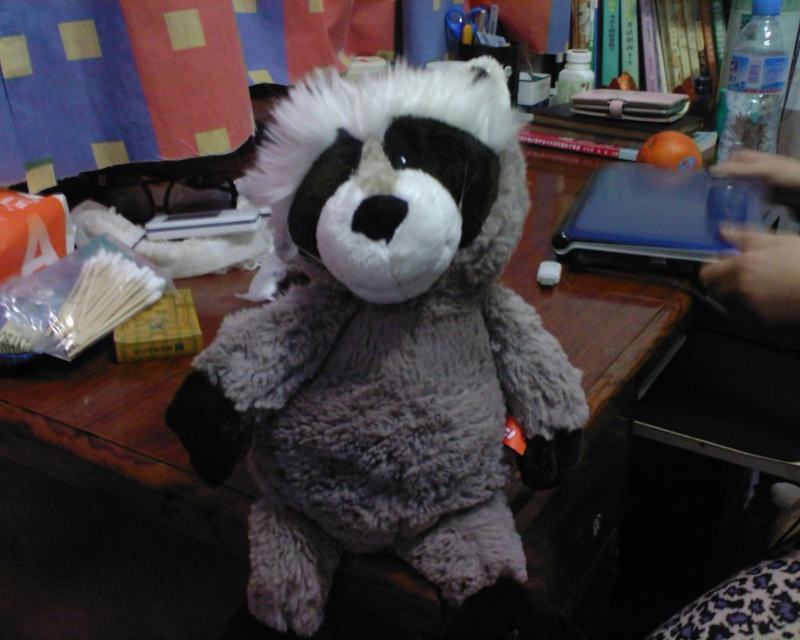
You are organizing items on a desk. You need to place a new item between the fluffy gray teddy bear at center and the slate gray plastic laptop at upper right. Based on their positions, which object should the new item be closer to?

The new item should be closer to the fluffy gray teddy bear at center because it is nearer to the viewer compared to the slate gray plastic laptop at upper right.

Looking at this image, you are a photographer trying to capture a closeup shot of the fluffy gray teddy bear at center. Given that your camera can focus on objects within 16 inches, will the teddy bear be in focus?

The fluffy gray teddy bear at center is 16.11 inches from the camera, which is just beyond the 16 inches focus range. Therefore, the teddy bear will not be in focus.